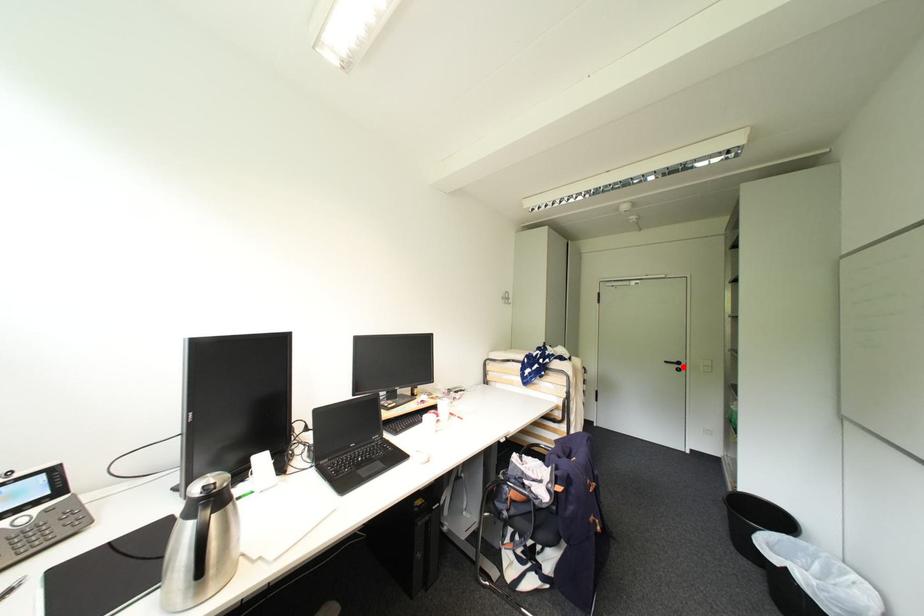
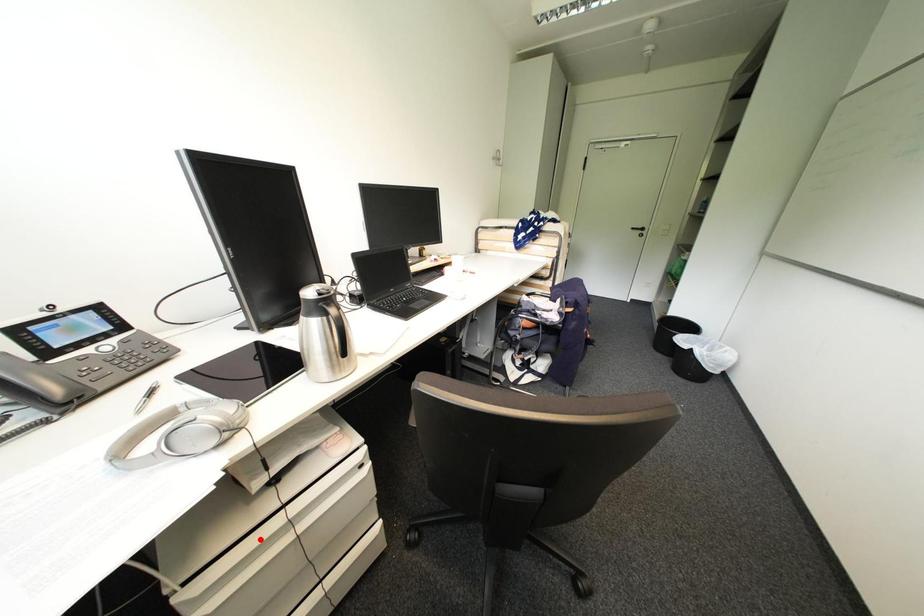
I am providing you with two images of the same scene from different viewpoints. A red point is marked on the first image and another point is marked on the second image. Do the highlighted points in image1 and image2 indicate the same real-world spot?

No